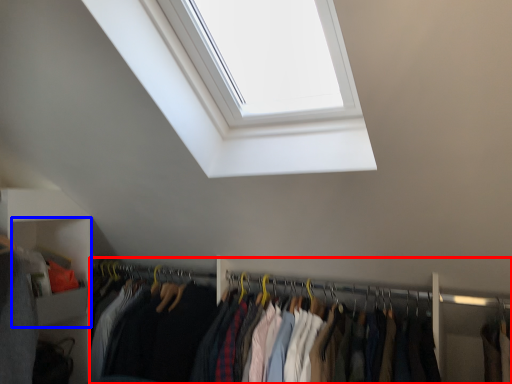
Question: Which of the following is the closest to the observer, closet (highlighted by a red box) or cabinet (highlighted by a blue box)?

Choices:
 (A) closet
 (B) cabinet

Answer: (A)